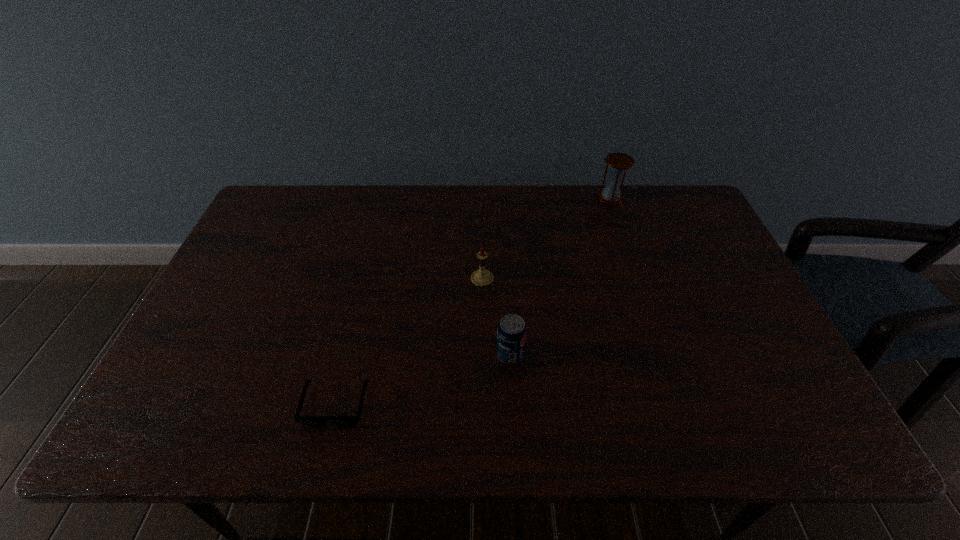
Identify the location of the rightmost object. (618, 163).

Where is `the tallest object`? the tallest object is located at coordinates (618, 163).

The image size is (960, 540). I want to click on the third object from right to left, so click(481, 277).

I want to click on the third nearest object, so click(481, 277).

Identify the location of the second nearest object. (511, 335).

Where is `the second object from right to left`? the second object from right to left is located at coordinates (511, 335).

Identify the location of the shortest object. This screenshot has height=540, width=960. (306, 420).

Where is `sunglasses`? The image size is (960, 540). sunglasses is located at coordinates (306, 420).

I want to click on vacant space located 0.240m on the front of the rightmost object, so click(630, 254).

You are a GUI agent. You are given a task and a screenshot of the screen. Output one action in this format:
    pyautogui.click(x=<x>, y=<y>)
    Task: Click on the free space located 0.080m on the right of the second object from left to right
    
    Given the screenshot: What is the action you would take?
    pyautogui.click(x=521, y=279)